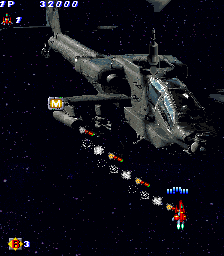
The height and width of the screenshot is (256, 224). I want to click on window, so click(169, 110).